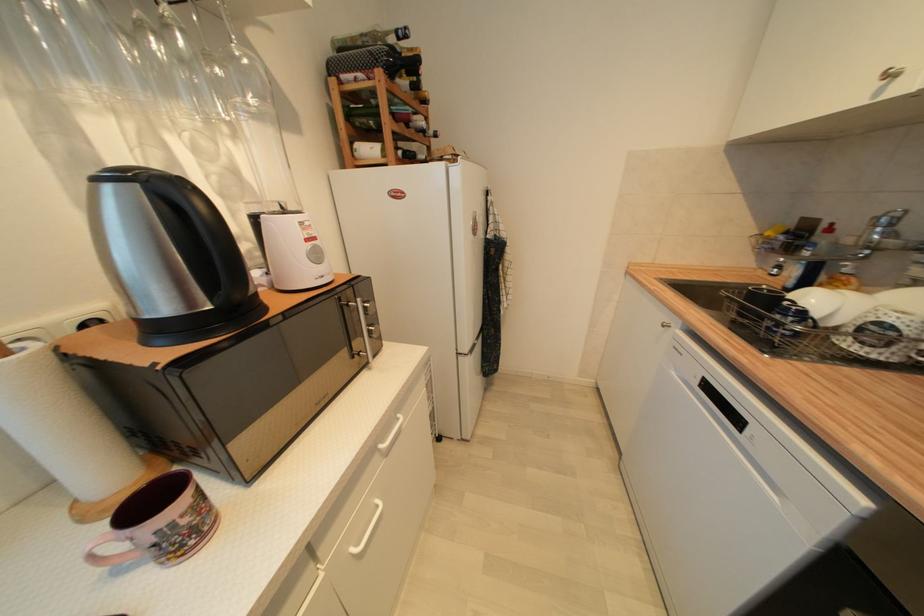
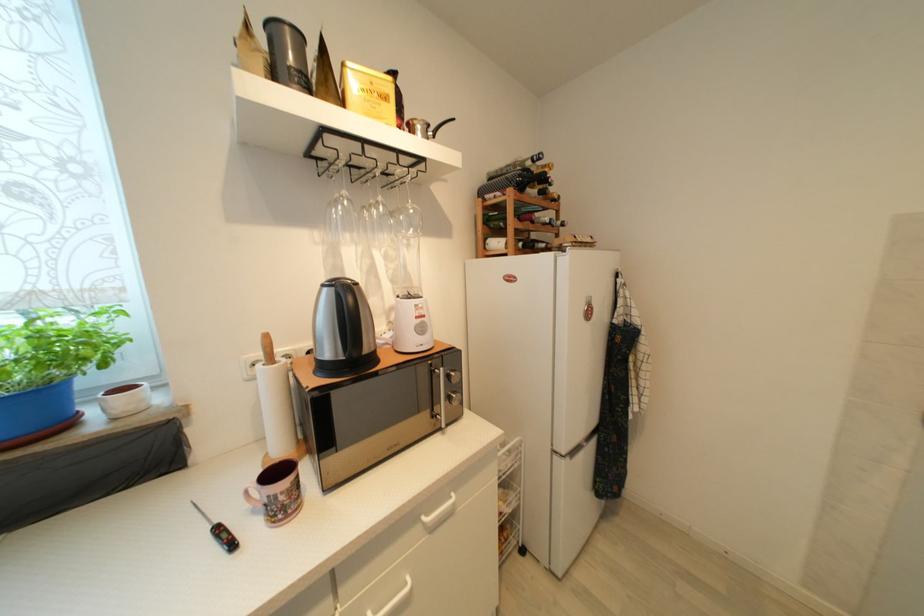
Where in the second image is the point corresponding to point (250, 63) from the first image?

(417, 213)